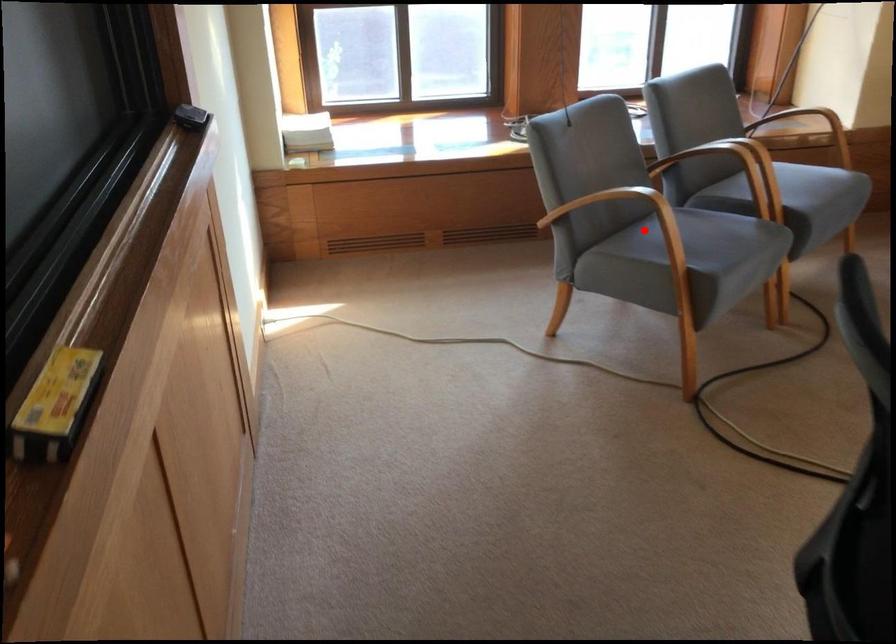
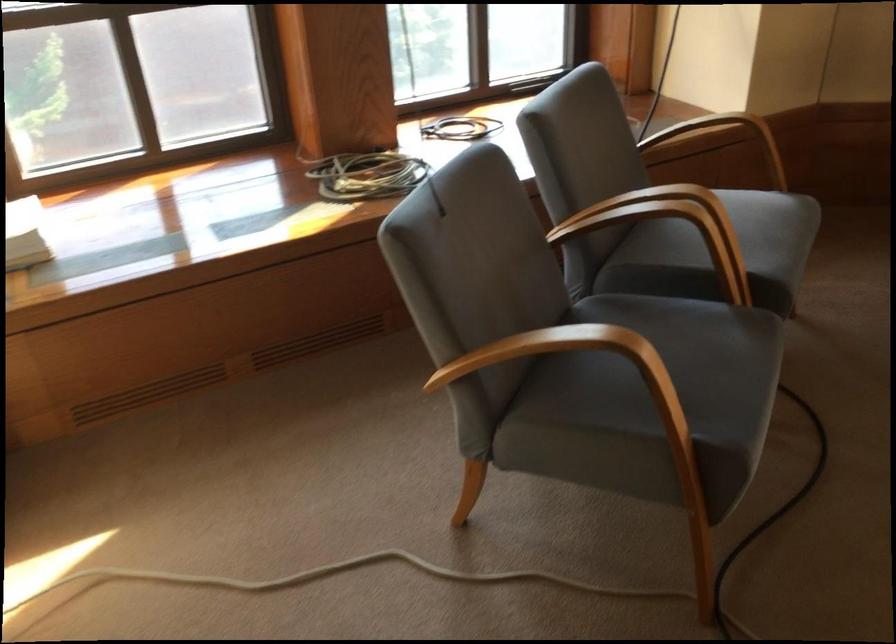
Find the pixel in the second image that matches the highlighted location in the first image.

(591, 375)